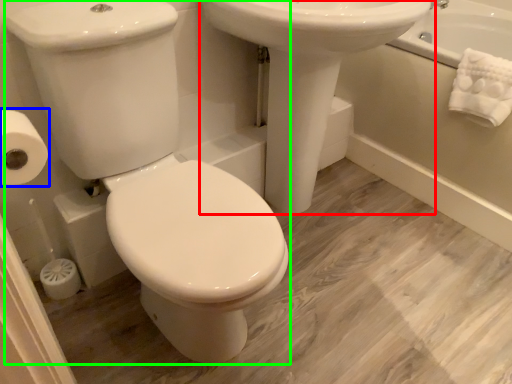
Question: Considering the real-world distances, which object is farthest from sink (highlighted by a red box)? toilet paper (highlighted by a blue box) or porcelain (highlighted by a green box)?

Choices:
 (A) toilet paper
 (B) porcelain

Answer: (A)